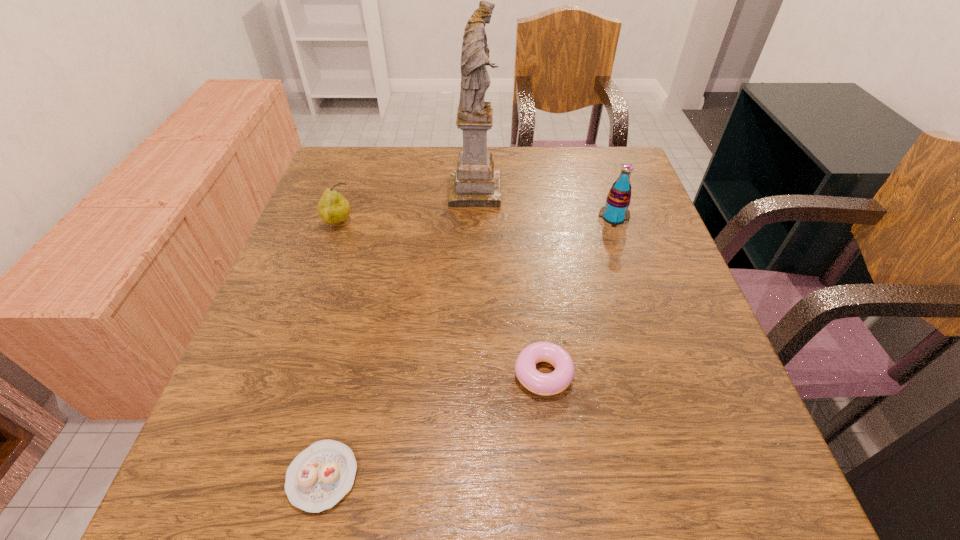
Where is `free region located on the front-facing side of the sculpture`? free region located on the front-facing side of the sculpture is located at coordinates (554, 192).

Identify the location of vacant space located on the back of the soda. This screenshot has height=540, width=960. (603, 186).

Locate an element on the screen. blank space located on the back of the pear is located at coordinates (366, 146).

Find the location of a particular element. This screenshot has width=960, height=540. vacant area located on the right of the fourth farthest object is located at coordinates (612, 373).

Image resolution: width=960 pixels, height=540 pixels. I want to click on vacant space situated 0.090m on the left of the cupcake, so (x=227, y=476).

Find the location of a particular element. object at the far edge is located at coordinates [x=475, y=183].

The image size is (960, 540). In order to click on object that is positioned at the near edge in this screenshot , I will do `click(320, 476)`.

Where is `pear that is at the left edge`? Image resolution: width=960 pixels, height=540 pixels. pear that is at the left edge is located at coordinates (333, 208).

The image size is (960, 540). Identify the location of cupcake present at the left edge. (320, 476).

Find the location of `object located at the right edge`. object located at the right edge is located at coordinates (615, 212).